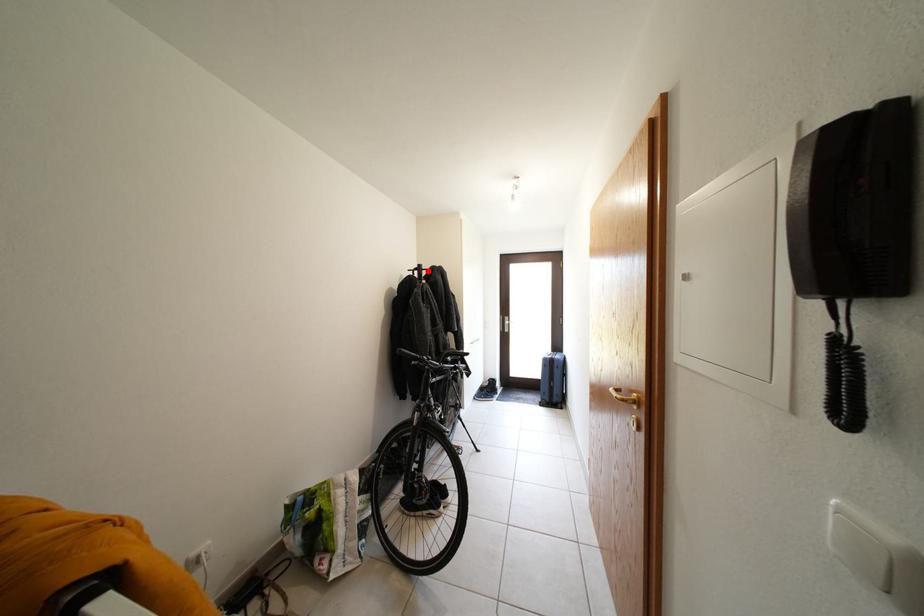
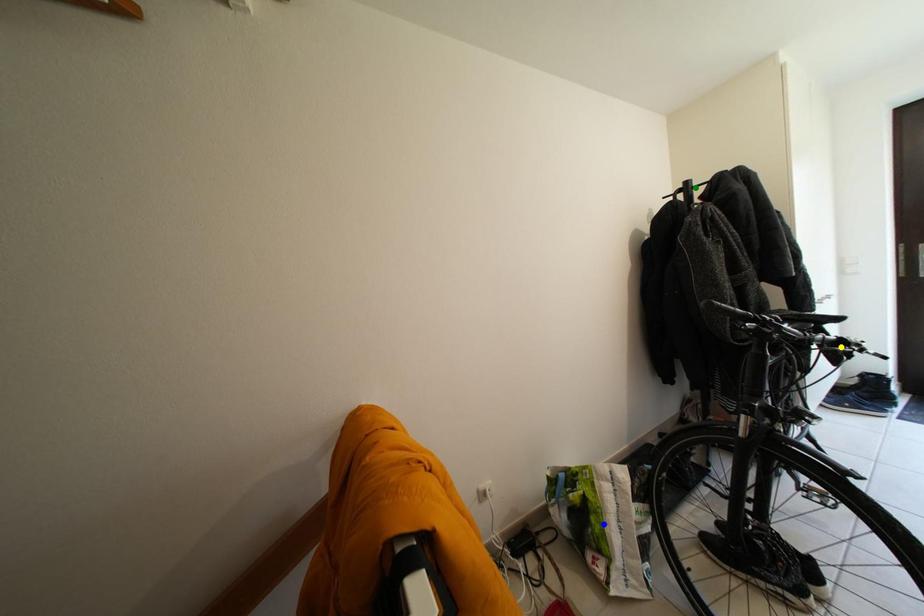
Question: I am providing you with two images of the same scene from different viewpoints. A red point is marked on the first image. You are given multiple points on the second image. Can you choose the point in image 2 that corresponds to the point in image 1?

Choices:
 (A) green point
 (B) blue point
 (C) yellow point

Answer: (A)